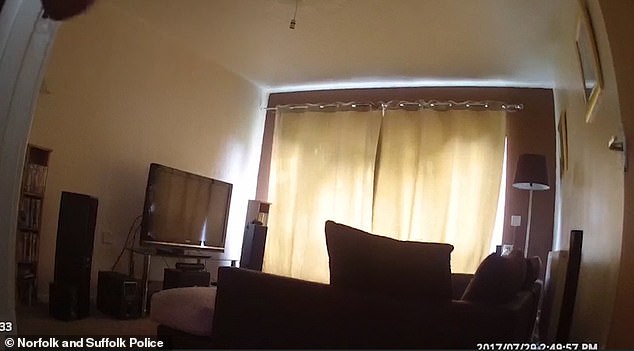
The image size is (634, 351). Find the location of `framed pictures`. framed pictures is located at coordinates (589, 83), (563, 153).